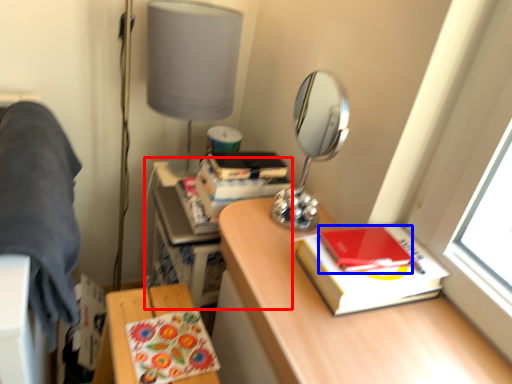
Question: Which object is closer to the camera taking this photo, computer desk (highlighted by a red box) or notebook (highlighted by a blue box)?

Choices:
 (A) computer desk
 (B) notebook

Answer: (B)